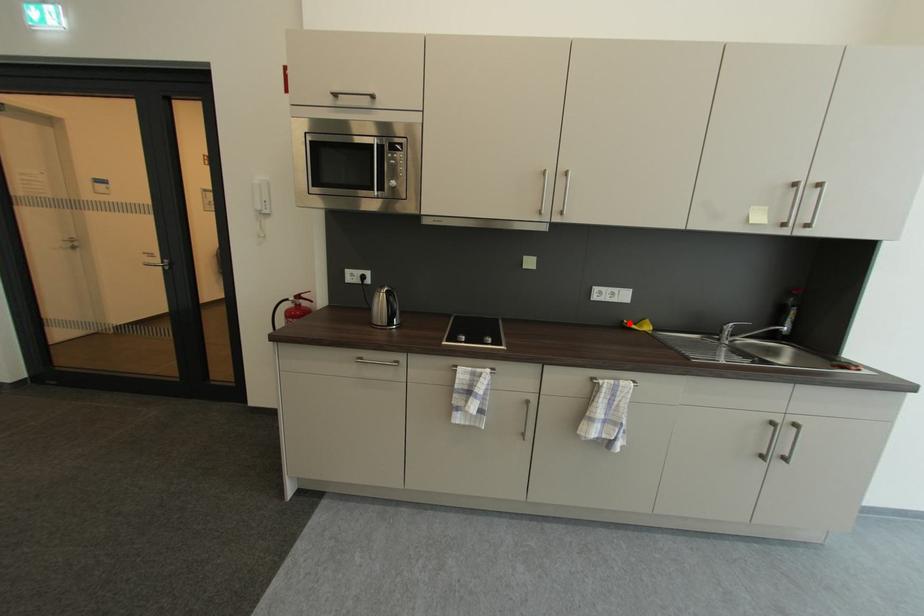
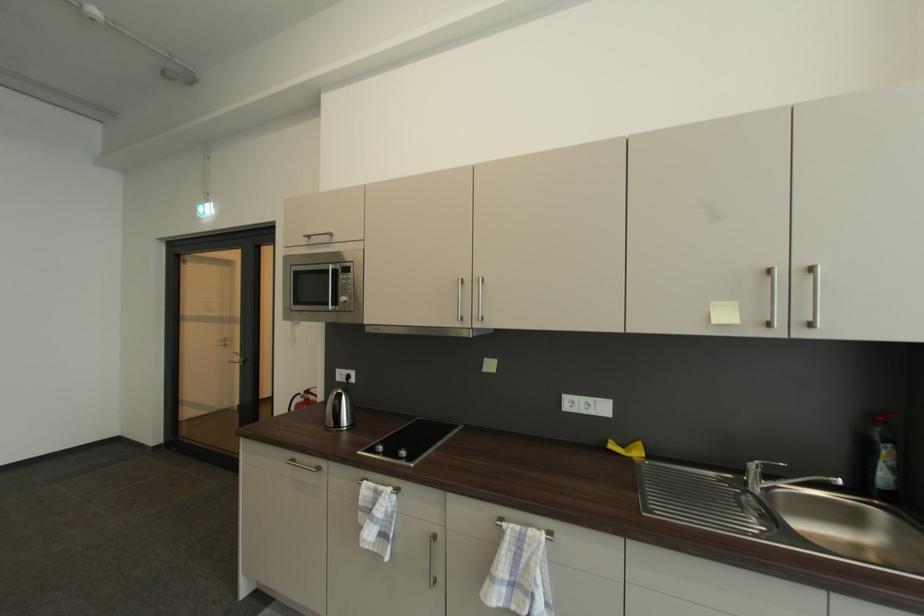
Question: I am providing you with two images of the same scene from different viewpoints. Given a red point in image1, look at the same physical point in image2. Is it:

Choices:
 (A) Closer to the viewpoint
 (B) Farther from the viewpoint

Answer: (B)